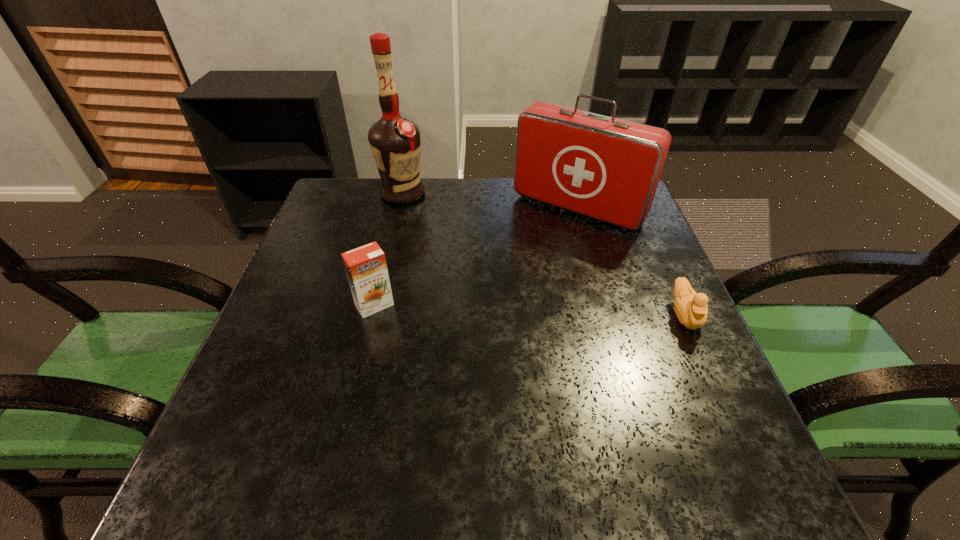
This screenshot has width=960, height=540. I want to click on vacant area between the duckling and the tallest object, so click(x=543, y=254).

Find the location of a particular element. The width and height of the screenshot is (960, 540). blank region between the orange juice and the tallest object is located at coordinates [x=389, y=249].

Identify the location of blank region between the tallest object and the second shortest object. (389, 249).

This screenshot has height=540, width=960. I want to click on empty location between the liquor and the second tallest object, so (490, 201).

You are a GUI agent. You are given a task and a screenshot of the screen. Output one action in this format:
    pyautogui.click(x=<x>, y=<y>)
    Task: Click on the vacant space that is in between the liquor and the third shortest object
    
    Given the screenshot: What is the action you would take?
    pyautogui.click(x=490, y=201)

Select which object appears as the third closest to the shortest object. Please provide its 2D coordinates. Your answer should be formatted as a tuple, i.e. [(x, y)], where the tuple contains the x and y coordinates of a point satisfying the conditions above.

[(395, 143)]

Point out which object is positioned as the third nearest to the liquor. Please provide its 2D coordinates. Your answer should be formatted as a tuple, i.e. [(x, y)], where the tuple contains the x and y coordinates of a point satisfying the conditions above.

[(690, 307)]